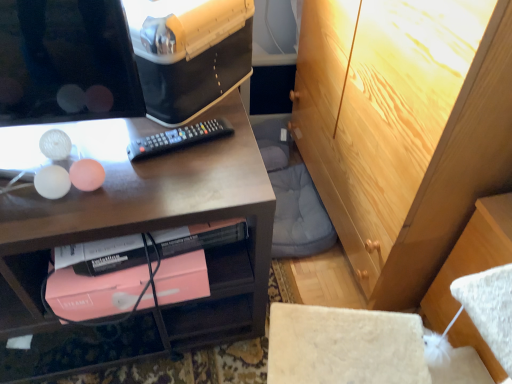
Locate an element on the screen. Image resolution: width=512 pixels, height=384 pixels. free location in front of black plastic remote at center is located at coordinates (161, 191).